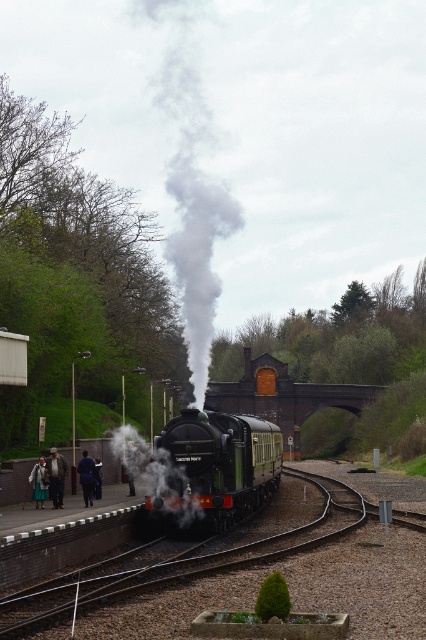
You are a passenger waiting at the station platform and want to find the person wearing the light brown leather coat at lower left and the dark blue coat at lower left. Which coat is closer to you?

The light brown leather coat at lower left is closer to you than the dark blue coat at lower left.